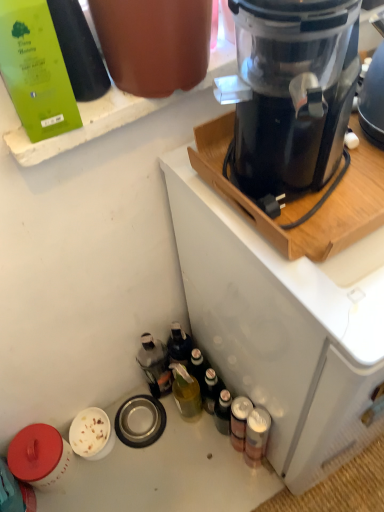
Question: From the image's perspective, is black plastic blender at upper right over green matte bottle at upper left, the 3th bottle ordered from the bottom?

Choices:
 (A) yes
 (B) no

Answer: (B)

Question: From a real-world perspective, is black plastic blender at upper right over green matte bottle at upper left, positioned as the 1th bottle in top-to-bottom order?

Choices:
 (A) yes
 (B) no

Answer: (B)

Question: Can you confirm if black plastic blender at upper right is taller than green matte bottle at upper left, the 3th bottle ordered from the bottom?

Choices:
 (A) yes
 (B) no

Answer: (A)

Question: Can you confirm if black plastic blender at upper right is smaller than green matte bottle at upper left, positioned as the 1th bottle in top-to-bottom order?

Choices:
 (A) yes
 (B) no

Answer: (B)

Question: Can you confirm if black plastic blender at upper right is wider than green matte bottle at upper left, positioned as the 1th bottle in top-to-bottom order?

Choices:
 (A) yes
 (B) no

Answer: (A)

Question: Is metallic silver can at lower right, arranged as the third bottle when viewed from the left, in front of or behind green matte bottle at upper left, which ranks as the 3th bottle in back-to-front order, in the image?

Choices:
 (A) behind
 (B) front

Answer: (A)

Question: From their relative heights in the image, would you say metallic silver can at lower right, the 2th bottle positioned from the front, is taller or shorter than green matte bottle at upper left, positioned as the 1th bottle in top-to-bottom order?

Choices:
 (A) tall
 (B) short

Answer: (A)

Question: From a real-world perspective, is metallic silver can at lower right, arranged as the third bottle when viewed from the left, physically located above or below green matte bottle at upper left, which ranks as the 3th bottle in back-to-front order?

Choices:
 (A) below
 (B) above

Answer: (A)

Question: Considering the relative positions of metallic silver can at lower right, the 1th bottle in the bottom-to-top sequence, and green matte bottle at upper left, which ranks as the first bottle in left-to-right order, in the image provided, is metallic silver can at lower right, the 1th bottle in the bottom-to-top sequence, to the left or to the right of green matte bottle at upper left, which ranks as the first bottle in left-to-right order,?

Choices:
 (A) right
 (B) left

Answer: (A)

Question: Is black plastic blender at upper right situated inside translucent plastic bottle at lower left, the second bottle viewed from the left, or outside?

Choices:
 (A) inside
 (B) outside

Answer: (B)

Question: Is black plastic blender at upper right in front of or behind translucent plastic bottle at lower left, the 2th bottle from the top, in the image?

Choices:
 (A) front
 (B) behind

Answer: (A)

Question: In the image, is black plastic blender at upper right on the left side or the right side of translucent plastic bottle at lower left, the second bottle viewed from the left?

Choices:
 (A) left
 (B) right

Answer: (B)

Question: From a real-world perspective, is black plastic blender at upper right positioned above or below translucent plastic bottle at lower left, the second bottle viewed from the left?

Choices:
 (A) above
 (B) below

Answer: (A)

Question: Does point (162, 357) appear closer or farther from the camera than point (261, 106)?

Choices:
 (A) closer
 (B) farther

Answer: (B)

Question: From a real-world perspective, is translucent plastic bottle at lower left, the 2th bottle from the top, above or below black plastic blender at upper right?

Choices:
 (A) above
 (B) below

Answer: (B)